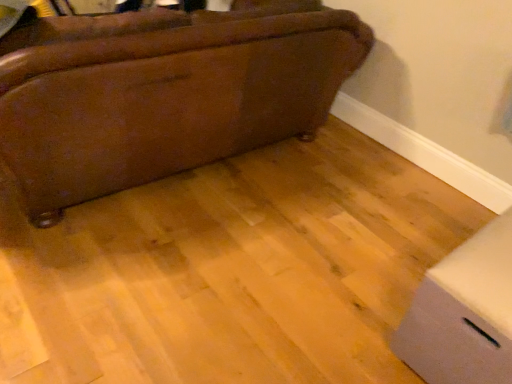
Question: Is white cardboard box at lower right beside brown leather couch at upper left?

Choices:
 (A) yes
 (B) no

Answer: (B)

Question: From a real-world perspective, is white cardboard box at lower right located beneath brown leather couch at upper left?

Choices:
 (A) no
 (B) yes

Answer: (B)

Question: Is white cardboard box at lower right positioned before brown leather couch at upper left?

Choices:
 (A) yes
 (B) no

Answer: (A)

Question: Can you confirm if white cardboard box at lower right is wider than brown leather couch at upper left?

Choices:
 (A) no
 (B) yes

Answer: (A)

Question: Is white cardboard box at lower right surrounding brown leather couch at upper left?

Choices:
 (A) no
 (B) yes

Answer: (A)

Question: Is white cardboard box at lower right not within brown leather couch at upper left?

Choices:
 (A) yes
 (B) no

Answer: (A)

Question: Does brown leather couch at upper left have a smaller size compared to white cardboard box at lower right?

Choices:
 (A) no
 (B) yes

Answer: (A)

Question: Considering the relative sizes of brown leather couch at upper left and white cardboard box at lower right in the image provided, is brown leather couch at upper left shorter than white cardboard box at lower right?

Choices:
 (A) no
 (B) yes

Answer: (A)

Question: Does brown leather couch at upper left have a lesser width compared to white cardboard box at lower right?

Choices:
 (A) no
 (B) yes

Answer: (A)

Question: Is brown leather couch at upper left bigger than white cardboard box at lower right?

Choices:
 (A) no
 (B) yes

Answer: (B)

Question: From a real-world perspective, is brown leather couch at upper left over white cardboard box at lower right?

Choices:
 (A) no
 (B) yes

Answer: (B)

Question: Considering the relative sizes of brown leather couch at upper left and white cardboard box at lower right in the image provided, is brown leather couch at upper left taller than white cardboard box at lower right?

Choices:
 (A) yes
 (B) no

Answer: (A)

Question: Does point (484, 349) appear closer or farther from the camera than point (48, 188)?

Choices:
 (A) farther
 (B) closer

Answer: (B)